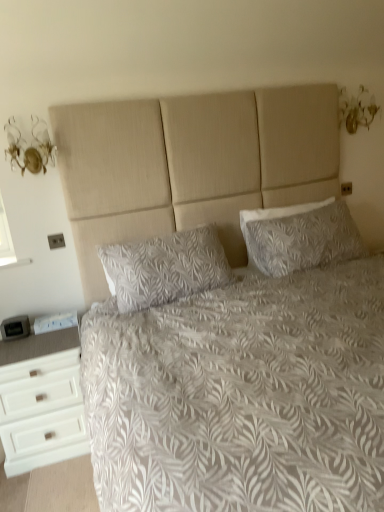
What is the approximate width of white textured pillow at upper right, acting as the second pillow starting from the left?

It is 6.90 inches.

Locate an element on the screen. This screenshot has width=384, height=512. white textured pillow at upper right, placed as the first pillow when sorted from right to left is located at coordinates (304, 240).

From the image's perspective, between white textured pillow at upper right, acting as the second pillow starting from the left, and white textured bed at center, who is located below?

From the image's view, white textured bed at center is below.

Who is taller, white textured pillow at upper right, acting as the second pillow starting from the left, or white textured bed at center?

white textured bed at center.

In order to click on bed on the left side of white textured pillow at upper right, acting as the second pillow starting from the left in this screenshot , I will do `click(225, 308)`.

In terms of height, does white textured bed at center look taller or shorter compared to white textured pillow at upper right, acting as the second pillow starting from the left?

In the image, white textured bed at center appears to be taller than white textured pillow at upper right, acting as the second pillow starting from the left.

Is white textured bed at center wider or thinner than white textured pillow at upper right, placed as the first pillow when sorted from right to left?

white textured bed at center is wider than white textured pillow at upper right, placed as the first pillow when sorted from right to left.

Looking at this image, can you confirm if white textured bed at center is smaller than white textured pillow at upper right, placed as the first pillow when sorted from right to left?

No.

From the image's perspective, would you say white textured bed at center is shown under white textured pillow at upper right, acting as the second pillow starting from the left?

Correct, white textured bed at center appears lower than white textured pillow at upper right, acting as the second pillow starting from the left, in the image.

Looking at their sizes, would you say white matte chest of drawers at lower left is wider or thinner than white leaf-patterned pillow at center, the second pillow in the right-to-left sequence?

Clearly, white matte chest of drawers at lower left has more width compared to white leaf-patterned pillow at center, the second pillow in the right-to-left sequence.

From the image's perspective, who appears lower, white matte chest of drawers at lower left or white leaf-patterned pillow at center, placed as the first pillow when sorted from left to right?

From the image's view, white matte chest of drawers at lower left is below.

From the picture: Does white textured bed at center turn towards white leaf-patterned pillow at center, the second pillow in the right-to-left sequence?

No, white textured bed at center is not oriented towards white leaf-patterned pillow at center, the second pillow in the right-to-left sequence.

The image size is (384, 512). In order to click on pillow that is the 1st object located above the white textured bed at center (from the image's perspective) in this screenshot , I will do `click(165, 268)`.

Is white textured bed at center in front of or behind white leaf-patterned pillow at center, placed as the first pillow when sorted from left to right, in the image?

white textured bed at center is positioned closer to the viewer than white leaf-patterned pillow at center, placed as the first pillow when sorted from left to right.

Is white textured pillow at upper right, placed as the first pillow when sorted from right to left, further to camera compared to white matte chest of drawers at lower left?

Yes, white textured pillow at upper right, placed as the first pillow when sorted from right to left, is behind white matte chest of drawers at lower left.

In the scene shown: Between white textured pillow at upper right, acting as the second pillow starting from the left, and white matte chest of drawers at lower left, which one has larger width?

Wider between the two is white matte chest of drawers at lower left.

Is white textured pillow at upper right, placed as the first pillow when sorted from right to left, spatially inside white matte chest of drawers at lower left, or outside of it?

white textured pillow at upper right, placed as the first pillow when sorted from right to left, lies outside white matte chest of drawers at lower left.

Which is less distant, [262,256] or [31,456]?

Point [262,256] is farther from the camera than point [31,456].

Can white leaf-patterned pillow at center, the second pillow in the right-to-left sequence, be found inside white textured pillow at upper right, acting as the second pillow starting from the left?

No, white textured pillow at upper right, acting as the second pillow starting from the left, does not contain white leaf-patterned pillow at center, the second pillow in the right-to-left sequence.

Does white textured pillow at upper right, acting as the second pillow starting from the left, turn towards white leaf-patterned pillow at center, the second pillow in the right-to-left sequence?

No, white textured pillow at upper right, acting as the second pillow starting from the left, is not aimed at white leaf-patterned pillow at center, the second pillow in the right-to-left sequence.

Can you tell me how much white textured pillow at upper right, acting as the second pillow starting from the left, and white leaf-patterned pillow at center, placed as the first pillow when sorted from left to right, differ in facing direction?

0.00114 degrees.

Looking at this image, considering the sizes of objects white textured pillow at upper right, acting as the second pillow starting from the left, and white leaf-patterned pillow at center, the second pillow in the right-to-left sequence, in the image provided, who is taller, white textured pillow at upper right, acting as the second pillow starting from the left, or white leaf-patterned pillow at center, the second pillow in the right-to-left sequence,?

Standing taller between the two is white leaf-patterned pillow at center, the second pillow in the right-to-left sequence.

Is white matte chest of drawers at lower left not near white textured pillow at upper right, acting as the second pillow starting from the left?

Yes, white matte chest of drawers at lower left and white textured pillow at upper right, acting as the second pillow starting from the left, are located far from each other.

The height and width of the screenshot is (512, 384). Find the location of `the chest of drawers that is in front of the white textured pillow at upper right, placed as the first pillow when sorted from right to left`. the chest of drawers that is in front of the white textured pillow at upper right, placed as the first pillow when sorted from right to left is located at coordinates (41, 400).

Does white matte chest of drawers at lower left have a greater height compared to white textured pillow at upper right, acting as the second pillow starting from the left?

Correct, white matte chest of drawers at lower left is much taller as white textured pillow at upper right, acting as the second pillow starting from the left.

The height and width of the screenshot is (512, 384). I want to click on bed below the white textured pillow at upper right, acting as the second pillow starting from the left (from a real-world perspective), so click(225, 308).

Locate an element on the screen. The width and height of the screenshot is (384, 512). bed on the left of white textured pillow at upper right, acting as the second pillow starting from the left is located at coordinates (225, 308).

Which object lies further to the anchor point white leaf-patterned pillow at center, the second pillow in the right-to-left sequence, white textured bed at center or white textured pillow at upper right, acting as the second pillow starting from the left?

white textured pillow at upper right, acting as the second pillow starting from the left, is positioned further to the anchor white leaf-patterned pillow at center, the second pillow in the right-to-left sequence.

Looking at this image, when comparing their distances from white textured pillow at upper right, placed as the first pillow when sorted from right to left, does white textured bed at center or white leaf-patterned pillow at center, the second pillow in the right-to-left sequence, seem closer?

white textured bed at center.

From the picture: From the image, which object appears to be farther from white matte chest of drawers at lower left, white textured pillow at upper right, placed as the first pillow when sorted from right to left, or white leaf-patterned pillow at center, placed as the first pillow when sorted from left to right?

white textured pillow at upper right, placed as the first pillow when sorted from right to left.

When comparing their distances from white textured bed at center, does white leaf-patterned pillow at center, placed as the first pillow when sorted from left to right, or white matte chest of drawers at lower left seem closer?

Based on the image, white leaf-patterned pillow at center, placed as the first pillow when sorted from left to right, appears to be nearer to white textured bed at center.

Estimate the real-world distances between objects in this image. Which object is further from white textured bed at center, white matte chest of drawers at lower left or white textured pillow at upper right, acting as the second pillow starting from the left?

white matte chest of drawers at lower left is positioned further to the anchor white textured bed at center.

Which object lies further to the anchor point white matte chest of drawers at lower left, white textured bed at center or white textured pillow at upper right, placed as the first pillow when sorted from right to left?

The object further to white matte chest of drawers at lower left is white textured pillow at upper right, placed as the first pillow when sorted from right to left.

When comparing their distances from white leaf-patterned pillow at center, the second pillow in the right-to-left sequence, does white textured pillow at upper right, acting as the second pillow starting from the left, or white matte chest of drawers at lower left seem closer?

white textured pillow at upper right, acting as the second pillow starting from the left, lies closer to white leaf-patterned pillow at center, the second pillow in the right-to-left sequence, than the other object.

Which object lies further to the anchor point white leaf-patterned pillow at center, the second pillow in the right-to-left sequence, white textured bed at center or white matte chest of drawers at lower left?

white matte chest of drawers at lower left.

Identify the location of the chest of drawers located between white textured bed at center and white leaf-patterned pillow at center, the second pillow in the right-to-left sequence, in the depth direction. (41, 400).

Locate an element on the screen. pillow between white matte chest of drawers at lower left and white textured pillow at upper right, placed as the first pillow when sorted from right to left, in the horizontal direction is located at coordinates (165, 268).

Find the location of `the chest of drawers positioned between white textured bed at center and white textured pillow at upper right, placed as the first pillow when sorted from right to left, from near to far`. the chest of drawers positioned between white textured bed at center and white textured pillow at upper right, placed as the first pillow when sorted from right to left, from near to far is located at coordinates (41, 400).

Find the location of a particular element. This screenshot has width=384, height=512. pillow between white textured bed at center and white textured pillow at upper right, placed as the first pillow when sorted from right to left, along the z-axis is located at coordinates (165, 268).